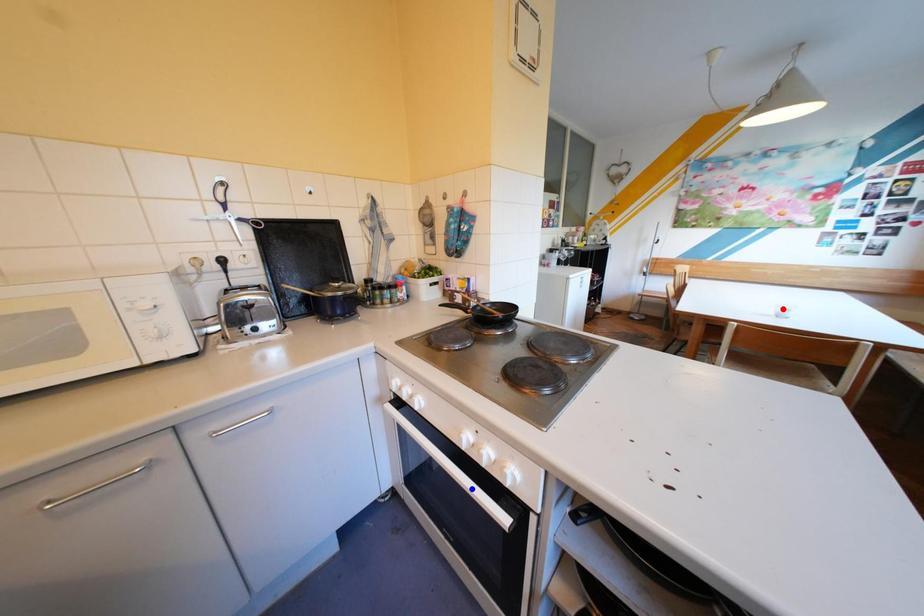
Question: Two points are marked on the image. Which point is closer to the camera?

Choices:
 (A) Blue point is closer.
 (B) Red point is closer.

Answer: (A)